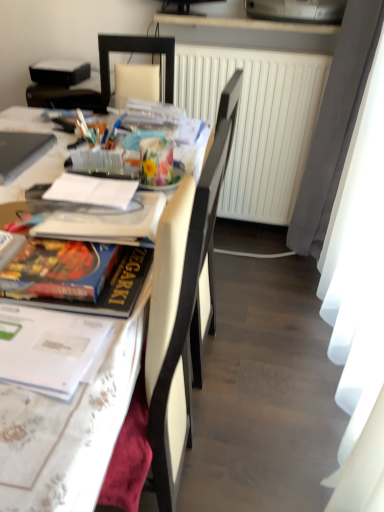
I want to click on floral-patterned paper at center, so click(x=156, y=161).

Image resolution: width=384 pixels, height=512 pixels. What do you see at coordinates (60, 72) in the screenshot?
I see `black matte projector at upper left, which is the 3th magazine from bottom to top` at bounding box center [60, 72].

You are a GUI agent. You are given a task and a screenshot of the screen. Output one action in this format:
    pyautogui.click(x=<x>, y=<y>)
    Task: Click on the matte board game at left, which is the second magazine from top to bottom
    This screenshot has height=512, width=384.
    Given the screenshot: What is the action you would take?
    pyautogui.click(x=107, y=222)

You are a GUI agent. You are given a task and a screenshot of the screen. Output one action in this format:
    pyautogui.click(x=<x>, y=<y>)
    Task: Click on the white leather chair at center
    This screenshot has height=512, width=384.
    Given the screenshot: What is the action you would take?
    pyautogui.click(x=170, y=343)

You are a GUI agent. You are given a task and a screenshot of the screen. Output one action in this format:
    pyautogui.click(x=<x>, y=<y>)
    Task: Click on the magazine that is the 1st object to the left of the white matte radiator at center, starting at the anchor
    The width and height of the screenshot is (384, 512).
    Given the screenshot: What is the action you would take?
    pyautogui.click(x=107, y=222)

Which object is further away from the camera, white matte radiator at center or matte board game at left, placed as the 2th magazine when sorted from back to front?

white matte radiator at center is further away from the camera.

Considering the relative sizes of white matte radiator at center and matte board game at left, the second magazine ordered from the bottom, in the image provided, is white matte radiator at center shorter than matte board game at left, the second magazine ordered from the bottom,?

Incorrect, the height of white matte radiator at center does not fall short of that of matte board game at left, the second magazine ordered from the bottom.

How far apart are matte board game at left, which is the second magazine from top to bottom, and white matte radiator at center?

A distance of 1.21 meters exists between matte board game at left, which is the second magazine from top to bottom, and white matte radiator at center.

In the image, there is a matte board game at left, the second magazine ordered from the bottom. At what (x,y) coordinates should I click in order to perform the action: click on radiator below it (from a real-world perspective). Please return your answer as a coordinate pair (x, y). Looking at the image, I should click on (257, 122).

Consider the image. From a real-world perspective, which is physically above, matte board game at left, placed as the 2th magazine when sorted from back to front, or white matte radiator at center?

matte board game at left, placed as the 2th magazine when sorted from back to front, is physically above.

Considering the relative positions of matte board game at left, which is the second magazine from top to bottom, and white matte radiator at center in the image provided, is matte board game at left, which is the second magazine from top to bottom, to the left of white matte radiator at center from the viewer's perspective?

Indeed, matte board game at left, which is the second magazine from top to bottom, is positioned on the left side of white matte radiator at center.

Is white matte radiator at center bigger or smaller than matte silver laptop at upper left?

white matte radiator at center is bigger than matte silver laptop at upper left.

Considering the positions of objects white matte radiator at center and matte silver laptop at upper left in the image provided, who is more to the right, white matte radiator at center or matte silver laptop at upper left?

From the viewer's perspective, white matte radiator at center appears more on the right side.

From the image's perspective, which one is positioned lower, white matte radiator at center or matte silver laptop at upper left?

From the image's view, matte silver laptop at upper left is below.

In terms of height, does white leather chair at center look taller or shorter compared to floral-patterned paper at center?

Considering their sizes, white leather chair at center has more height than floral-patterned paper at center.

Consider the image. Is white leather chair at center bigger than floral-patterned paper at center?

Yes, white leather chair at center is bigger than floral-patterned paper at center.

Is white leather chair at center wider or thinner than floral-patterned paper at center?

In the image, white leather chair at center appears to be wider than floral-patterned paper at center.

Is white leather chair at center aimed at floral-patterned paper at center?

No, white leather chair at center does not turn towards floral-patterned paper at center.

Could you tell me if white leather chair at center is facing hardcover book at left, which is the 1th magazine in bottom-to-top order?

Yes, white leather chair at center faces towards hardcover book at left, which is the 1th magazine in bottom-to-top order.

From the image's perspective, is white leather chair at center above or below hardcover book at left, the first magazine from the front?

From the image's perspective, white leather chair at center appears below hardcover book at left, the first magazine from the front.

Is white leather chair at center behind hardcover book at left, which ranks as the 3th magazine in back-to-front order?

No, the depth of white leather chair at center is less than that of hardcover book at left, which ranks as the 3th magazine in back-to-front order.

From the image's perspective, would you say white glossy table at left is shown under floral-patterned paper at center?

Yes, from the image's perspective, white glossy table at left is beneath floral-patterned paper at center.

Relative to floral-patterned paper at center, is white glossy table at left in front or behind?

Visually, white glossy table at left is located in front of floral-patterned paper at center.

How distant is white glossy table at left from floral-patterned paper at center?

They are 10.18 inches apart.

From the image's perspective, between white matte radiator at center and white leather chair at center, who is located below?

From the image's view, white leather chair at center is below.

From a real-world perspective, which is physically below, white matte radiator at center or white leather chair at center?

white leather chair at center.

Which object is wider, white matte radiator at center or white leather chair at center?

Wider between the two is white leather chair at center.

Where is `radiator to the right of matte board game at left, placed as the 2th magazine when sorted from back to front`? radiator to the right of matte board game at left, placed as the 2th magazine when sorted from back to front is located at coordinates (257, 122).

This screenshot has width=384, height=512. In order to click on the 1st magazine to the left of the white matte radiator at center, counting from the anchor's position in this screenshot , I will do `click(107, 222)`.

Based on their spatial positions, is white glossy table at left or floral-patterned paper at center further from hardcover book at left, which is the 1th magazine in bottom-to-top order?

Among the two, white glossy table at left is located further to hardcover book at left, which is the 1th magazine in bottom-to-top order.

Based on their spatial positions, is matte board game at left, positioned as the 2th magazine in front-to-back order, or floral-patterned paper at center closer to white glossy table at left?

floral-patterned paper at center.

Estimate the real-world distances between objects in this image. Which object is further from white paper at center, matte board game at left, positioned as the 2th magazine in front-to-back order, or hardcover book at left, positioned as the third magazine in top-to-bottom order?

Based on the image, hardcover book at left, positioned as the third magazine in top-to-bottom order, appears to be further to white paper at center.

Estimate the real-world distances between objects in this image. Which object is further from white paper at center, metallic silver printer at upper center or white leather chair at center?

metallic silver printer at upper center lies further to white paper at center than the other object.

Looking at the image, which one is located further to matte silver laptop at upper left, black matte projector at upper left, which is the 3th magazine from front to back, or matte board game at left, the second magazine ordered from the bottom?

black matte projector at upper left, which is the 3th magazine from front to back.

From the image, which object appears to be farther from white glossy table at left, white leather chair at center or metallic silver printer at upper center?

metallic silver printer at upper center is positioned further to the anchor white glossy table at left.

Estimate the real-world distances between objects in this image. Which object is closer to metallic silver printer at upper center, white matte radiator at center or black matte projector at upper left, the first magazine when ordered from back to front?

Among the two, white matte radiator at center is located nearer to metallic silver printer at upper center.

When comparing their distances from white leather chair at center, does white glossy table at left or floral-patterned paper at center seem further?

white glossy table at left is further to white leather chair at center.

Image resolution: width=384 pixels, height=512 pixels. I want to click on printer between matte board game at left, which is the second magazine from top to bottom, and white matte radiator at center in the front-back direction, so click(297, 10).

Find the location of a particular element. The image size is (384, 512). stationery positioned between white leather chair at center and matte silver laptop at upper left from near to far is located at coordinates (156, 161).

Identify the location of journal between matte silver laptop at upper left and white glossy table at left in the horizontal direction. The height and width of the screenshot is (512, 384). (92, 191).

The image size is (384, 512). I want to click on radiator between matte silver laptop at upper left and metallic silver printer at upper center from left to right, so click(257, 122).